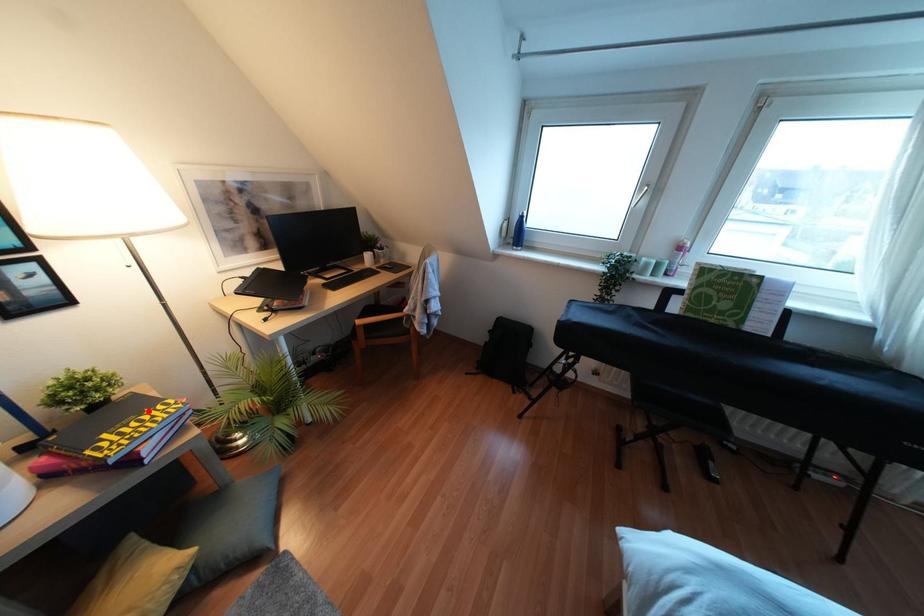
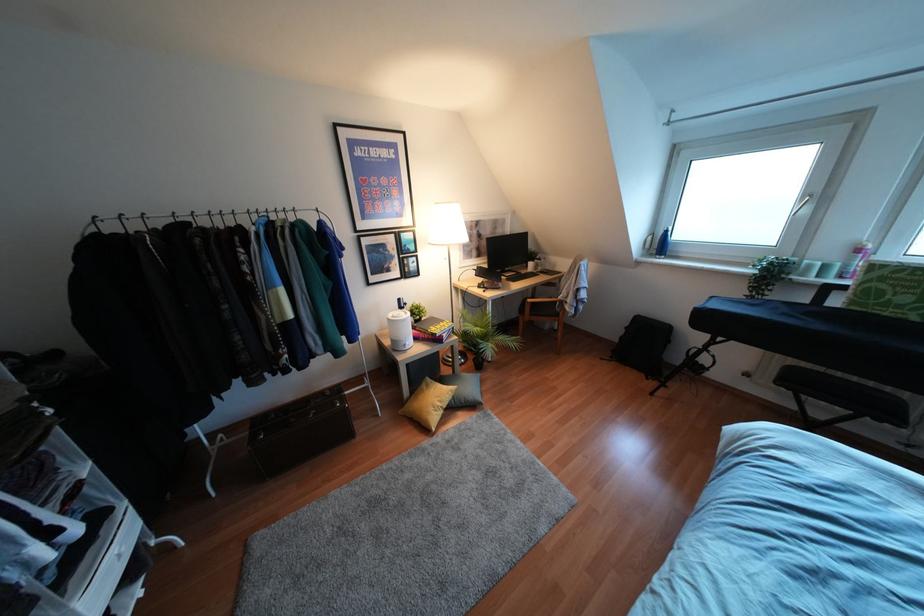
Where in the second image is the point corresponding to the highlighted location from the first image?

(441, 323)